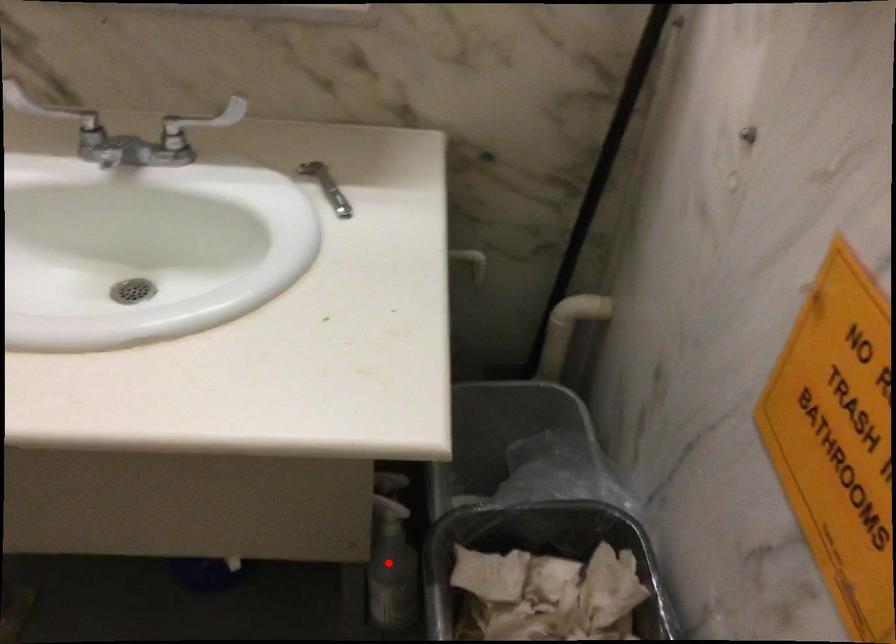
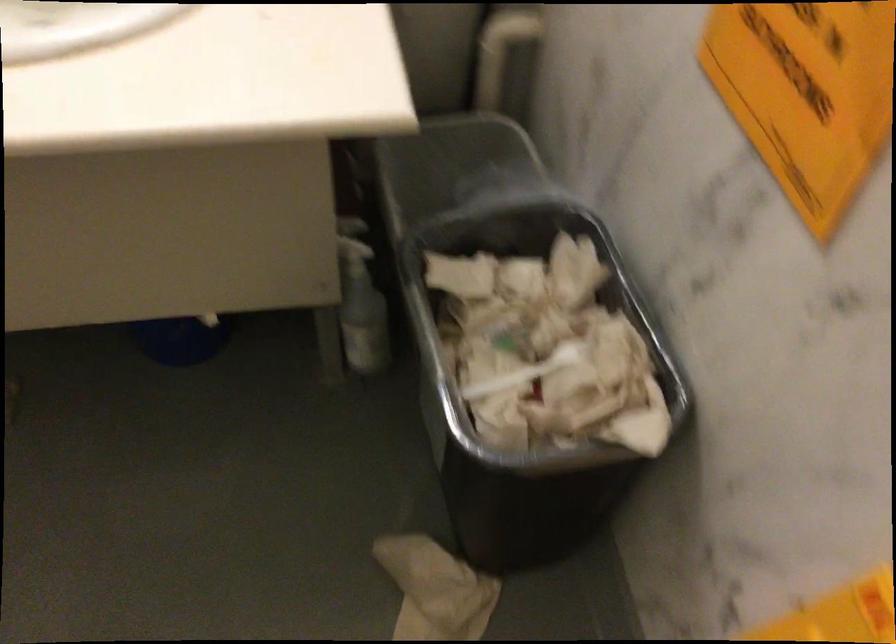
Where in the second image is the point corresponding to the highlighted location from the first image?

(360, 303)